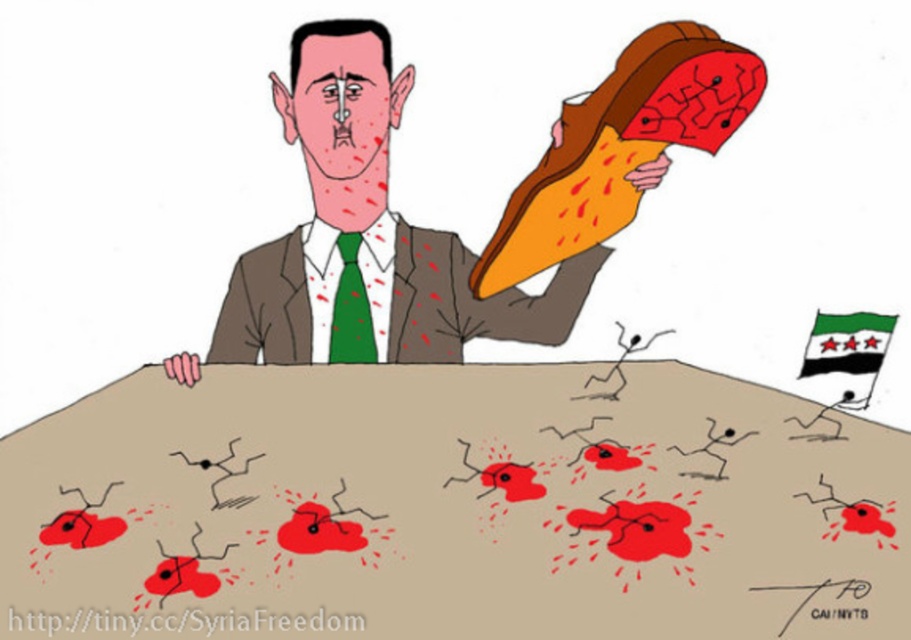
Is the position of beige matte table at center less distant than that of brown textured suit at center?

That is True.

Find the location of `beige matte table at center`. beige matte table at center is located at coordinates (462, 502).

Can you confirm if beige matte table at center is bigger than green tie at upper left?

No, beige matte table at center is not bigger than green tie at upper left.

Looking at this image, is beige matte table at center closer to the viewer compared to green tie at upper left?

Yes, beige matte table at center is closer to the viewer.

What do you see at coordinates (462, 502) in the screenshot? Image resolution: width=911 pixels, height=640 pixels. I see `beige matte table at center` at bounding box center [462, 502].

The height and width of the screenshot is (640, 911). What are the coordinates of `beige matte table at center` in the screenshot? It's located at (462, 502).

Does green tie at upper left have a greater height compared to brown textured suit at center?

Indeed, green tie at upper left has a greater height compared to brown textured suit at center.

Is green tie at upper left smaller than brown textured suit at center?

No.

Is point (279, 285) in front of point (512, 340)?

Yes, point (279, 285) is closer to viewer.

This screenshot has height=640, width=911. Find the location of `green tie at upper left`. green tie at upper left is located at coordinates (367, 236).